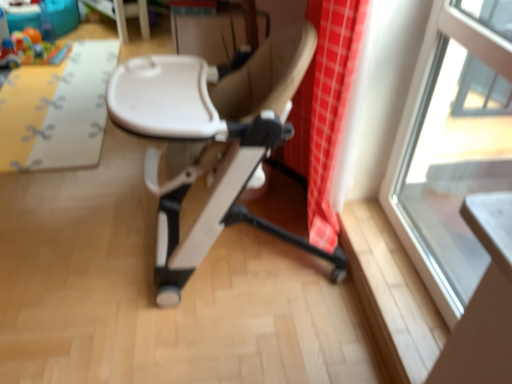
The image size is (512, 384). Identify the location of vacant space in beige leather chair at center (from a real-world perspective). [246, 254].